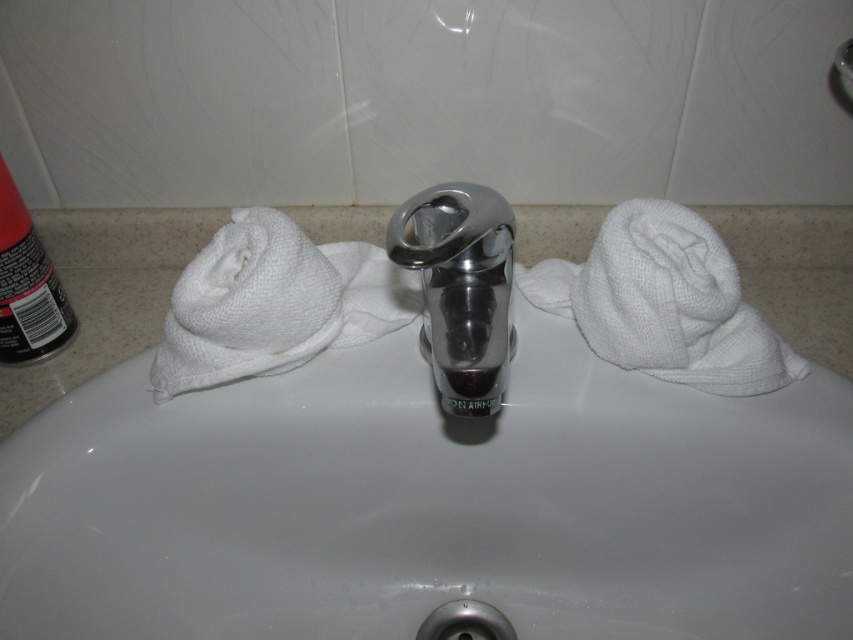
You are a bathroom designer planning to install a new faucet. The current polished chrome faucet at center is 34.70 centimeters away from the nearest towel. Is this distance sufficient to allow placing a standard 20 cm wide soap dish between them?

The distance between the polished chrome faucet at center and the nearest towel is 34.70 centimeters. A standard soap dish is 20 cm wide, so there is enough space to place it between them since 34.70 cm is greater than 20 cm.

You are a cleaning robot with a width of 30 centimeters. You are positioned to the left of the sink and want to move to the right to clean the faucet. Is there enough space between the polished chrome faucet at center and the black matte can at left for you to pass through?

The polished chrome faucet at center is 32.41 centimeters away from the black matte can at left. Since the robot is 30 centimeters wide, there is sufficient space for it to pass through the gap between the two objects.

You are designing a bathroom layout and need to ensure the white ceramic sink at center and the polished chrome faucet at center fit within a specific space. Which object requires more horizontal space due to its size?

The white ceramic sink at center requires more horizontal space because it has a larger size compared to the polished chrome faucet at center.